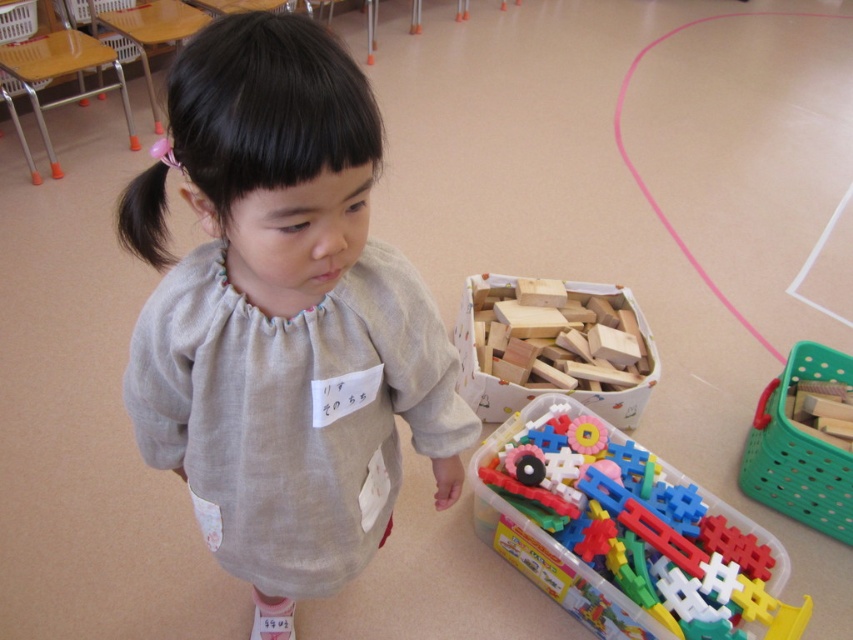
Is gray cotton shirt at center positioned behind wooden blocks at center?

No, gray cotton shirt at center is in front of wooden blocks at center.

Which is below, gray cotton shirt at center or wooden blocks at center?

wooden blocks at center is below.

Is point (187, 336) closer to viewer compared to point (529, 365)?

Yes, it is in front of point (529, 365).

Find the location of a particular element. The image size is (853, 640). gray cotton shirt at center is located at coordinates (283, 317).

Where is `gray cotton shirt at center`? Image resolution: width=853 pixels, height=640 pixels. gray cotton shirt at center is located at coordinates coord(283,317).

Between point (213, 221) and point (809, 524), which one is positioned behind?

The point (809, 524) is more distant.

Locate an element on the screen. This screenshot has width=853, height=640. gray cotton shirt at center is located at coordinates (283, 317).

Can you confirm if plastic colorful blocks at lower right is shorter than green plastic basket at right?

Indeed, plastic colorful blocks at lower right has a lesser height compared to green plastic basket at right.

Between point (486, 456) and point (817, 499), which one is positioned behind?

Point (817, 499)

Which is behind, point (486, 486) or point (807, 435)?

Positioned behind is point (807, 435).

Identify the location of plastic colorful blocks at lower right. (624, 532).